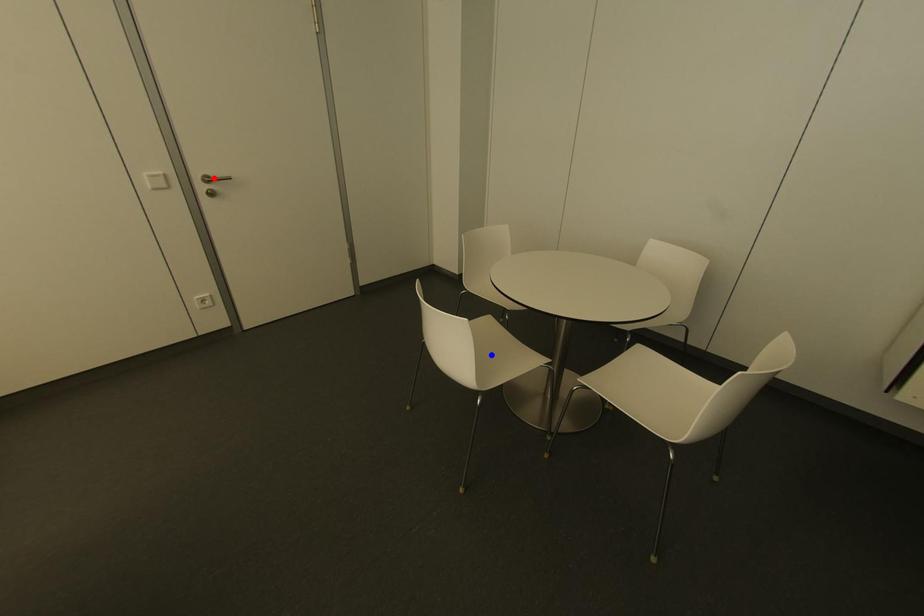
Question: Two points are marked on the image. Which point is closer to the camera?

Choices:
 (A) Blue point is closer.
 (B) Red point is closer.

Answer: (A)